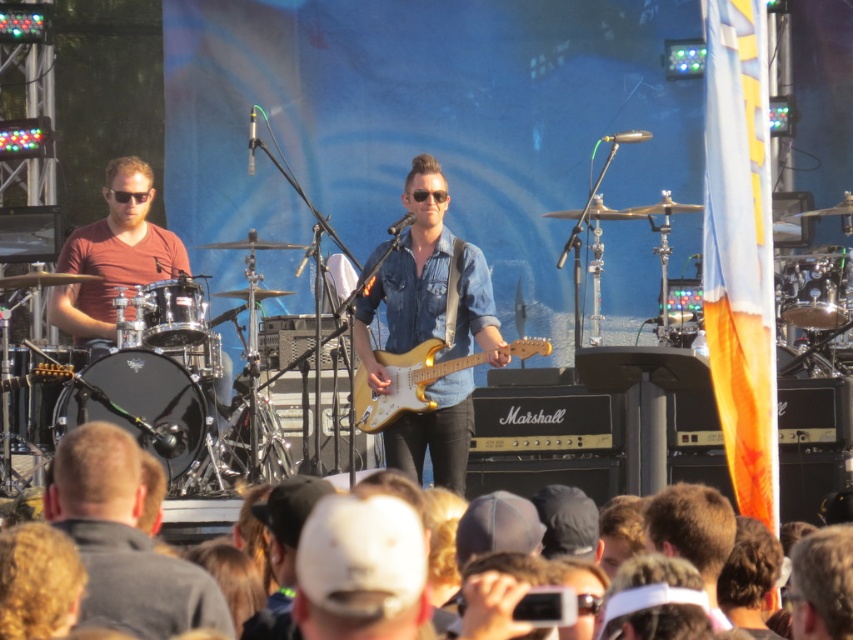
Question: Does denim shirt at center appear under matte red shirt at left?

Choices:
 (A) no
 (B) yes

Answer: (B)

Question: Which point is closer to the camera taking this photo?

Choices:
 (A) (80, 412)
 (B) (448, 355)

Answer: (A)

Question: Which point is farther to the camera?

Choices:
 (A) black drum at left
 (B) denim shirt at center
 (C) shiny black drum at center right

Answer: (B)

Question: Considering the relative positions of black drum at left and brushed metal drum at left in the image provided, where is black drum at left located with respect to brushed metal drum at left?

Choices:
 (A) below
 (B) above

Answer: (A)

Question: Is shiny black drum at left positioned behind glossy wood guitar at center?

Choices:
 (A) no
 (B) yes

Answer: (A)

Question: Which point is closer to the camera taking this photo?

Choices:
 (A) pos(403,260)
 (B) pos(194,376)
 (C) pos(192,388)

Answer: (C)